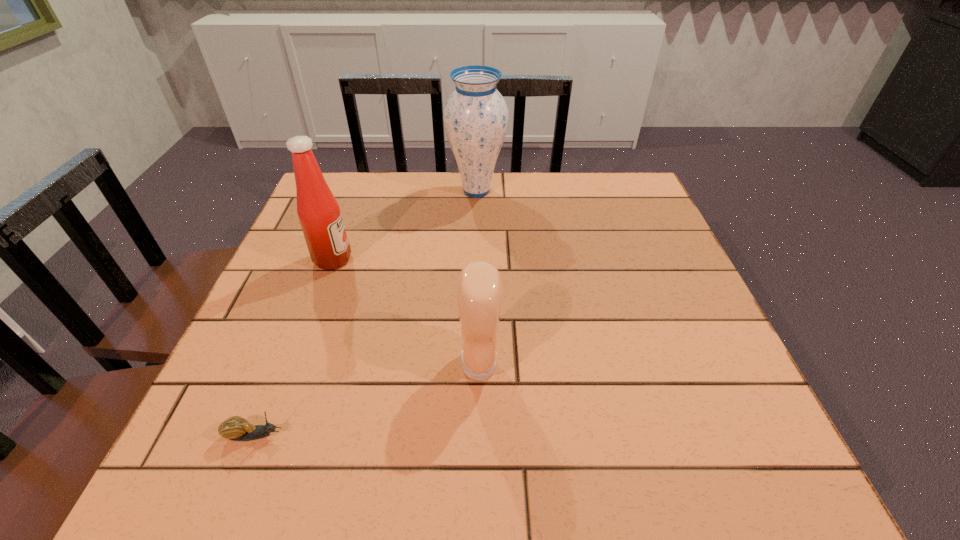
Where is `vacant space located 0.190m on the front-facing side of the escargot`? This screenshot has height=540, width=960. vacant space located 0.190m on the front-facing side of the escargot is located at coordinates (400, 435).

Find the location of a particular element. object that is at the far edge is located at coordinates pyautogui.click(x=476, y=117).

Identify the location of object located at the near edge. The image size is (960, 540). (235, 428).

Image resolution: width=960 pixels, height=540 pixels. In order to click on condiment that is at the left edge in this screenshot , I will do `click(319, 214)`.

Find the location of a particular element. The width and height of the screenshot is (960, 540). escargot positioned at the left edge is located at coordinates (235, 428).

At what (x,y) coordinates should I click in order to perform the action: click on object present at the near left corner. Please return your answer as a coordinate pair (x, y). Looking at the image, I should click on (235, 428).

The image size is (960, 540). In the image, there is a desktop. In order to click on vacant space at the far edge in this screenshot , I will do `click(376, 201)`.

At what (x,y) coordinates should I click in order to perform the action: click on free space at the near edge of the desktop. Please return your answer as a coordinate pair (x, y). The height and width of the screenshot is (540, 960). Looking at the image, I should click on (320, 449).

In the image, there is a desktop. At what (x,y) coordinates should I click in order to perform the action: click on vacant space at the left edge. Please return your answer as a coordinate pair (x, y). This screenshot has width=960, height=540. Looking at the image, I should click on (250, 342).

This screenshot has width=960, height=540. I want to click on free space at the right edge of the desktop, so click(x=640, y=230).